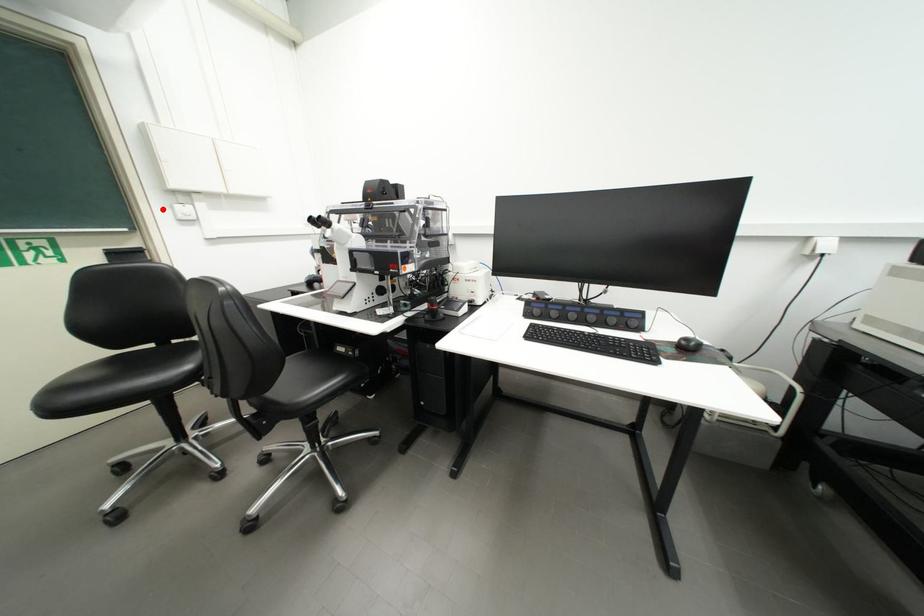
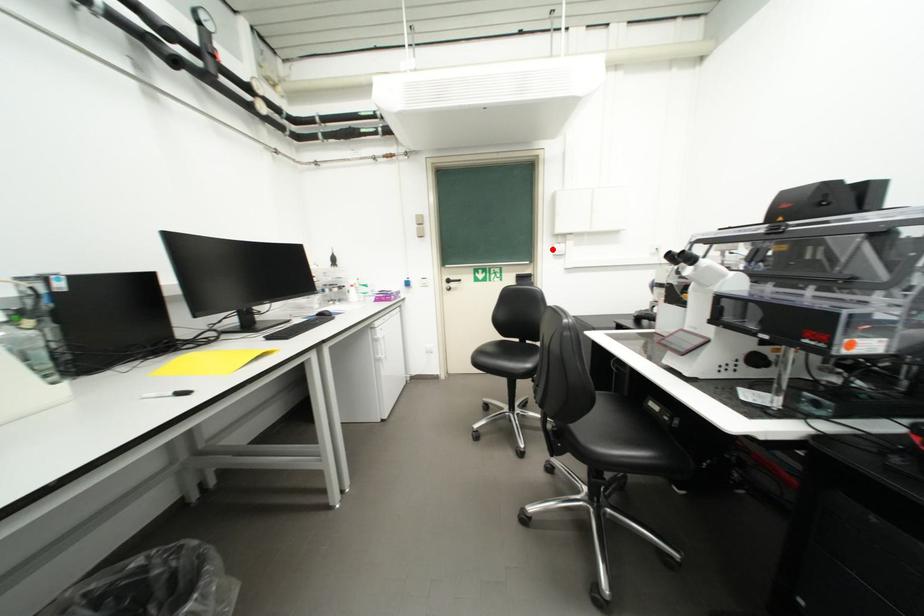
I am providing you with two images of the same scene from different viewpoints. A red point is marked on the first image and another point is marked on the second image. Is the marked point in image1 the same physical position as the marked point in image2?

Yes